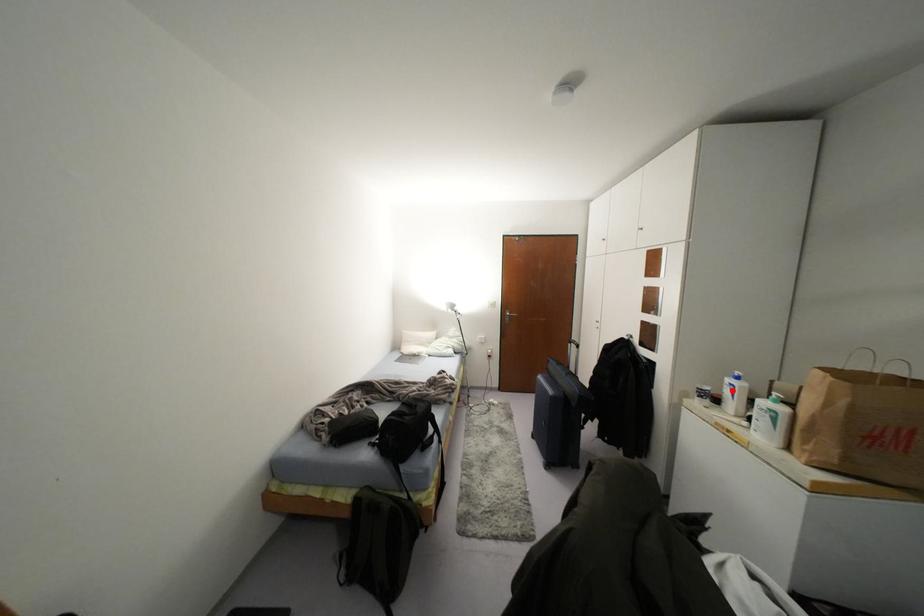
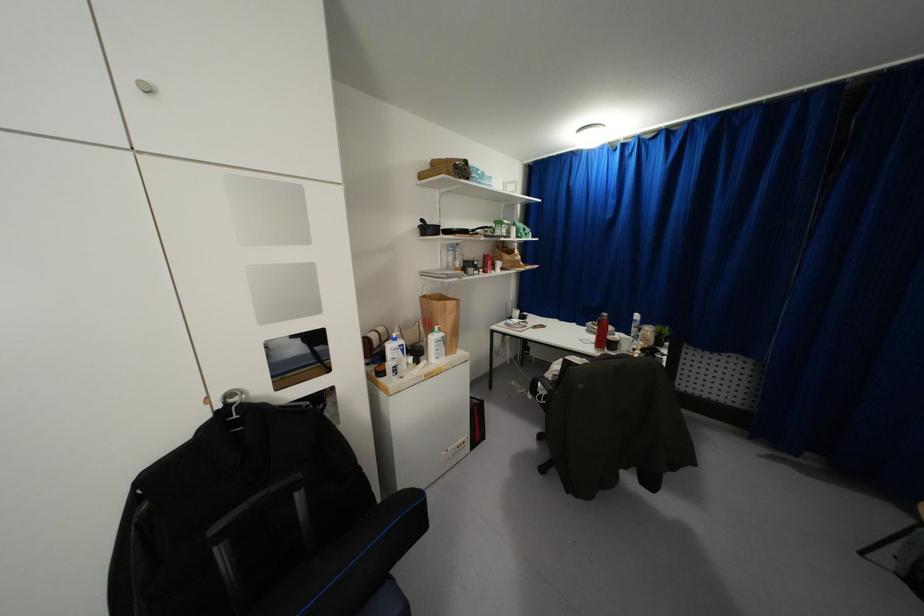
The point at the highlighted location is marked in the first image. Where is the corresponding point in the second image?

(402, 350)